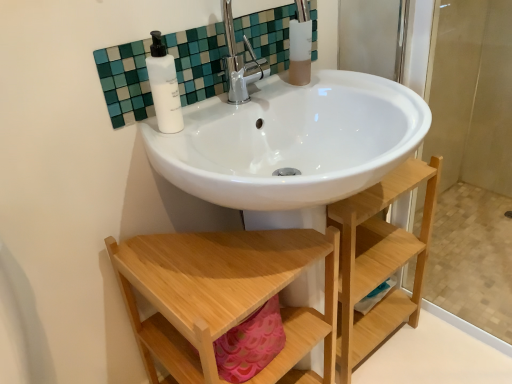
Question: From a real-world perspective, is natural wood shelf at lower center over white glossy sink at upper center?

Choices:
 (A) no
 (B) yes

Answer: (A)

Question: Is natural wood shelf at lower center aimed at white glossy sink at upper center?

Choices:
 (A) no
 (B) yes

Answer: (A)

Question: Is natural wood shelf at lower center positioned far away from white glossy sink at upper center?

Choices:
 (A) yes
 (B) no

Answer: (B)

Question: Is the position of natural wood shelf at lower center more distant than that of white glossy sink at upper center?

Choices:
 (A) no
 (B) yes

Answer: (A)

Question: From a real-world perspective, is natural wood shelf at lower center physically below white glossy sink at upper center?

Choices:
 (A) yes
 (B) no

Answer: (A)

Question: Considering the positions of white glossy sink at upper center and natural wood shelf at lower center in the image, is white glossy sink at upper center bigger or smaller than natural wood shelf at lower center?

Choices:
 (A) big
 (B) small

Answer: (B)

Question: Is white glossy sink at upper center spatially inside natural wood shelf at lower center, or outside of it?

Choices:
 (A) inside
 (B) outside

Answer: (B)

Question: Based on their positions, is white glossy sink at upper center located to the left or right of natural wood shelf at lower center?

Choices:
 (A) left
 (B) right

Answer: (A)

Question: From a real-world perspective, is white glossy sink at upper center physically located above or below natural wood shelf at lower center?

Choices:
 (A) below
 (B) above

Answer: (B)

Question: Considering their positions, is white matte bottle at upper center located in front of or behind natural wood shelf at lower center?

Choices:
 (A) behind
 (B) front

Answer: (A)

Question: From a real-world perspective, is white matte bottle at upper center above or below natural wood shelf at lower center?

Choices:
 (A) above
 (B) below

Answer: (A)

Question: From the image's perspective, is white matte bottle at upper center located above or below natural wood shelf at lower center?

Choices:
 (A) below
 (B) above

Answer: (B)

Question: Does point (166, 57) appear closer or farther from the camera than point (217, 336)?

Choices:
 (A) farther
 (B) closer

Answer: (A)

Question: From a real-world perspective, is natural wood shelf at lower center physically located above or below translucent frosted glass cup at upper center?

Choices:
 (A) below
 (B) above

Answer: (A)

Question: In the image, is natural wood shelf at lower center on the left side or the right side of translucent frosted glass cup at upper center?

Choices:
 (A) right
 (B) left

Answer: (B)